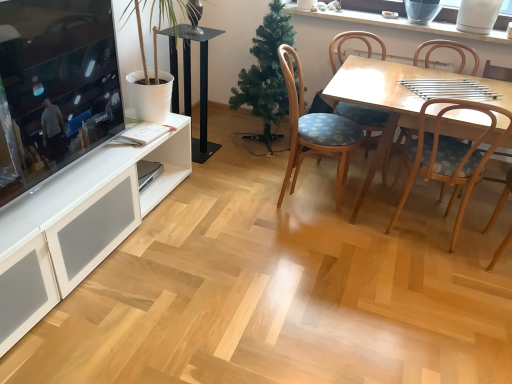
I want to click on vacant space in green matte christmas tree at center (from a real-world perspective), so click(251, 148).